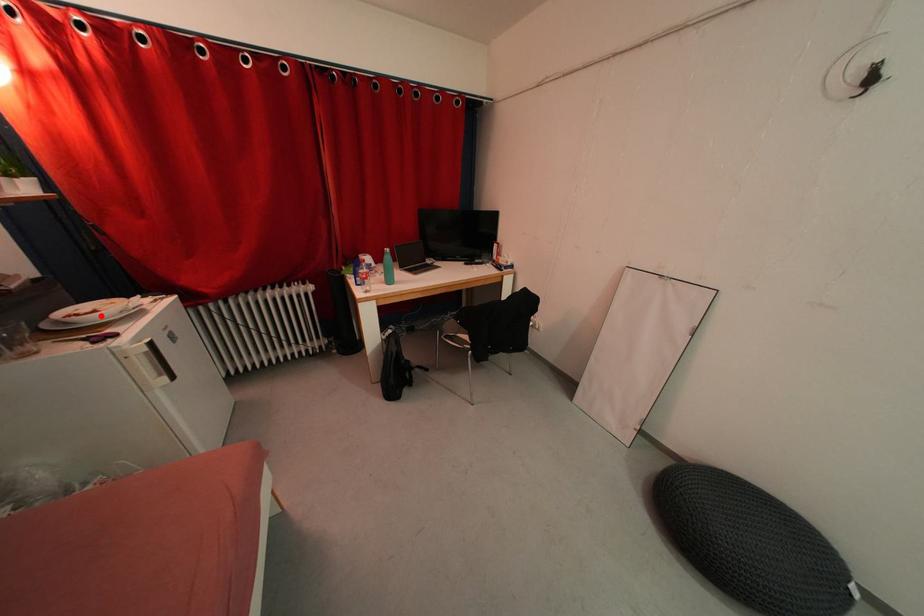
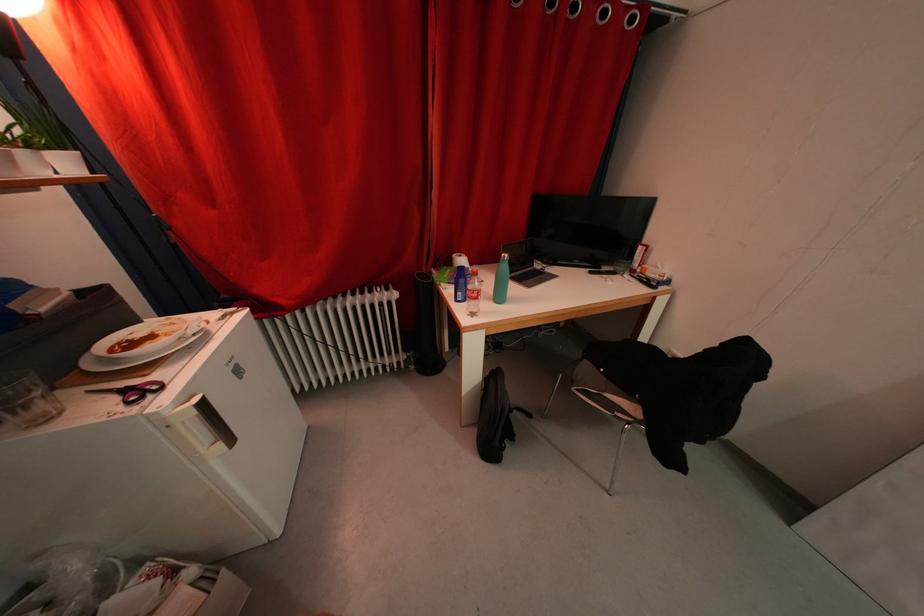
Find the pixel in the second image that matches the highlighted location in the first image.

(157, 341)